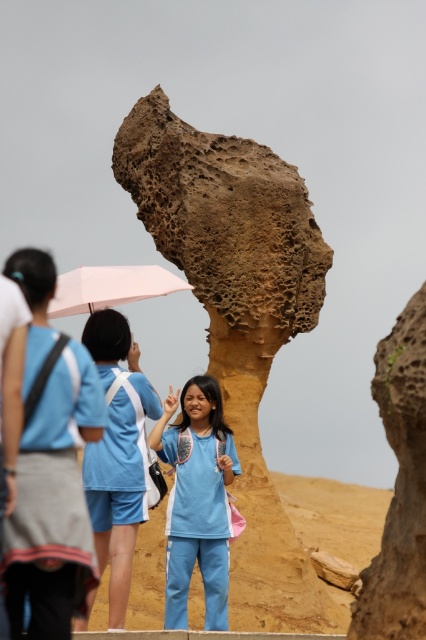
You are a geologist examining the rock formations in the scene. You notice two distinct types of rocks labeled as brown porous rock at center and brown rough rock at center. According to the description, which rock is situated higher in the image?

The brown porous rock at center is located above the brown rough rock at center, so it is situated higher in the image.

You are a photographer trying to capture the light blue fabric at center and the blue fabric shirt at center in the same frame. According to the scene description, which object should you focus on first to ensure both are in the frame?

The blue fabric shirt at center is behind the light blue fabric at center, so you should focus on the light blue fabric at center first to ensure both are in the frame.